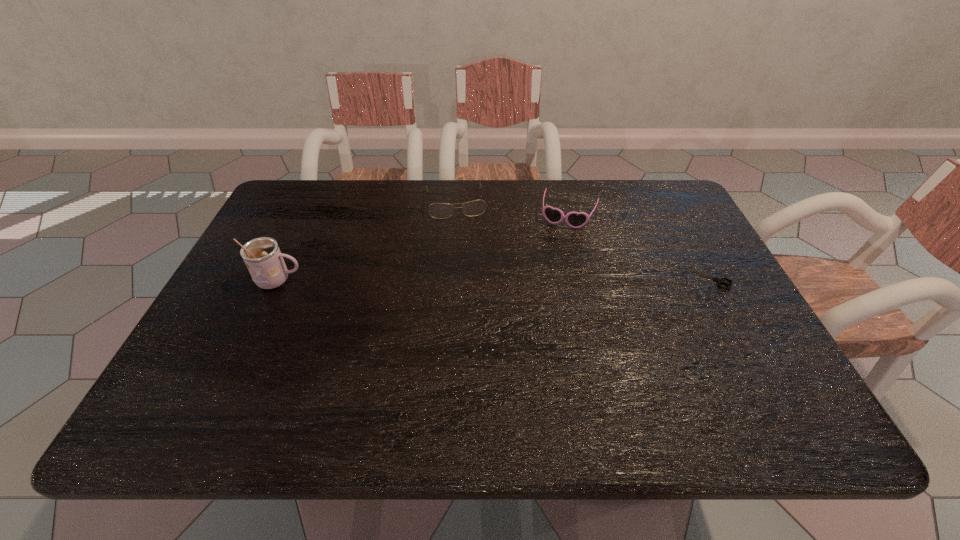
Find the location of `the tallest object`. the tallest object is located at coordinates (262, 256).

Identify the location of the leftmost object. Image resolution: width=960 pixels, height=540 pixels. (262, 256).

You are a GUI agent. You are given a task and a screenshot of the screen. Output one action in this format:
    pyautogui.click(x=<x>, y=<y>)
    Task: Click on the rightmost object
    
    Given the screenshot: What is the action you would take?
    pyautogui.click(x=719, y=280)

At what (x,y) coordinates should I click in order to perform the action: click on the shortest object. Please return your answer as a coordinate pair (x, y). This screenshot has height=540, width=960. Looking at the image, I should click on (719, 280).

You are a GUI agent. You are given a task and a screenshot of the screen. Output one action in this format:
    pyautogui.click(x=<x>, y=<y>)
    Task: Click on the spectacles
    The height and width of the screenshot is (540, 960).
    Given the screenshot: What is the action you would take?
    pyautogui.click(x=477, y=207)

This screenshot has width=960, height=540. I want to click on sunglasses, so click(x=553, y=215).

At what (x,y) coordinates should I click in order to perform the action: click on vacant space located on the side with the handle of the cup. Please return your answer as a coordinate pair (x, y). This screenshot has height=540, width=960. Looking at the image, I should click on (341, 281).

Locate an element on the screen. blank space located 0.390m on the back of the shortest object is located at coordinates (660, 185).

Locate an element on the screen. The width and height of the screenshot is (960, 540). free space located 0.280m on the front-facing side of the third object from right to left is located at coordinates (470, 286).

Where is `vacant space located 0.060m on the front-facing side of the third object from right to left`? The width and height of the screenshot is (960, 540). vacant space located 0.060m on the front-facing side of the third object from right to left is located at coordinates click(461, 232).